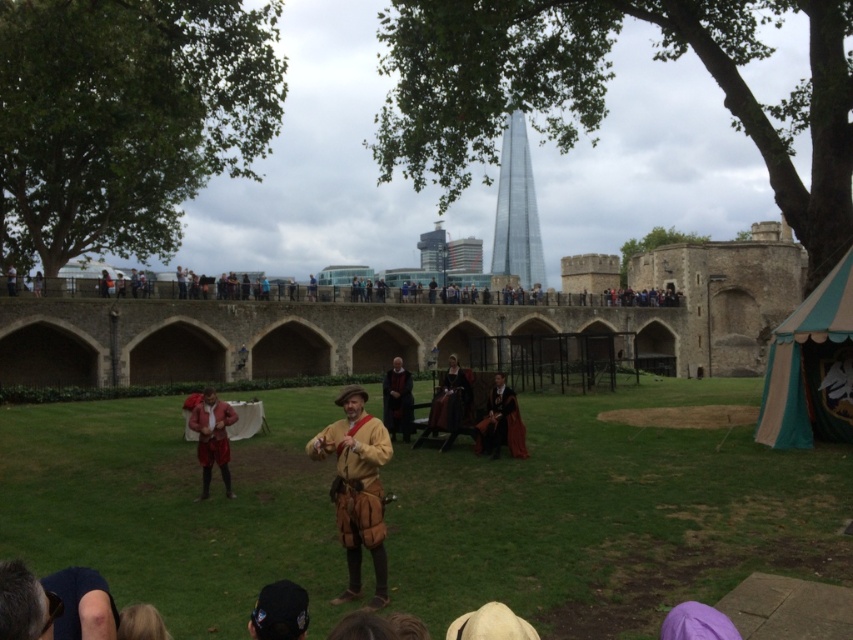
Consider the image. You are a photographer positioned at the edge of the grassy area where the performers are. You want to take a photo that includes both the glassy steel tower at center and the velvet black robe at center. Which object should you focus on first if you want to ensure both are in sharp focus?

The glassy steel tower at center has a larger size compared to velvet black robe at center, so you should focus on the glassy steel tower at center first to ensure both are in sharp focus.

You are standing in the grassy area where the performers are and want to take a photo of the glassy steel tower at center. Which direction should you face to capture it in your view?

The glassy steel tower at center is located at point 0.330 on the x and 0.606 on the y, so you should face towards the center of the image to capture it in your view.

You are a costume designer preparing for a historical play. You have two robes available for the lead actor who needs to wear a robe that covers more of their body. Which robe from the velvet black robe at center and smooth black robe at center would you choose?

The smooth black robe at center is larger in size compared to the velvet black robe at center, so it would cover more of the actor.